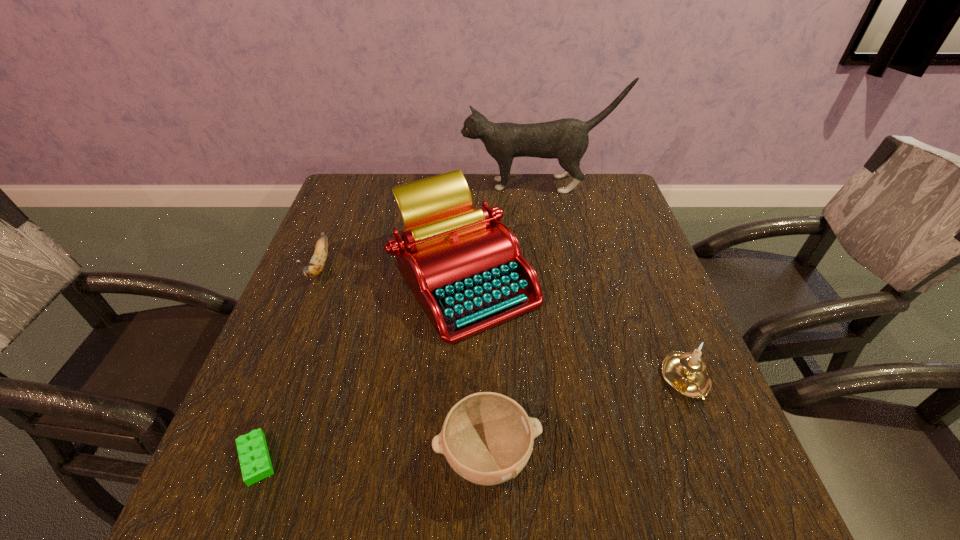
Find the location of a particular element. This screenshot has height=540, width=960. vacant space located 0.310m at the face of the tallest object is located at coordinates (363, 185).

Where is `blank space located on the typing side of the typewriter`? blank space located on the typing side of the typewriter is located at coordinates (457, 497).

You are a GUI agent. You are given a task and a screenshot of the screen. Output one action in this format:
    pyautogui.click(x=<x>, y=<y>)
    Task: Click on the free space located on the handle side of the candle holder
    
    Given the screenshot: What is the action you would take?
    pyautogui.click(x=717, y=458)

I want to click on vacant space located 0.350m at the stem of the banana, so click(255, 429).

Identify the location of vacant region located 0.320m on the right of the bowl. (731, 456).

At what (x,y) coordinates should I click in order to perform the action: click on vacant area situated on the back of the shortest object. Please return your answer as a coordinate pair (x, y). This screenshot has width=960, height=540. Looking at the image, I should click on (304, 332).

Identify the location of object that is at the far edge. This screenshot has height=540, width=960. (567, 140).

Identify the location of bowl situated at the near edge. The height and width of the screenshot is (540, 960). (487, 438).

The height and width of the screenshot is (540, 960). Find the location of `Lego present at the near edge`. Lego present at the near edge is located at coordinates (253, 453).

Image resolution: width=960 pixels, height=540 pixels. I want to click on banana that is at the left edge, so click(314, 268).